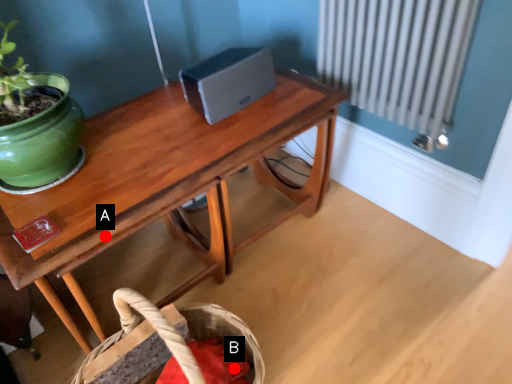
Question: Two points are circled on the image, labeled by A and B beside each circle. Which point appears closest to the camera in this image?

Choices:
 (A) A is closer
 (B) B is closer

Answer: (A)